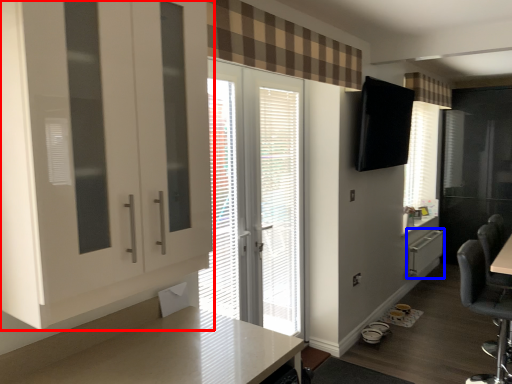
Question: Which object is closer to the camera taking this photo, cabinetry (highlighted by a red box) or file cabinet (highlighted by a blue box)?

Choices:
 (A) cabinetry
 (B) file cabinet

Answer: (A)